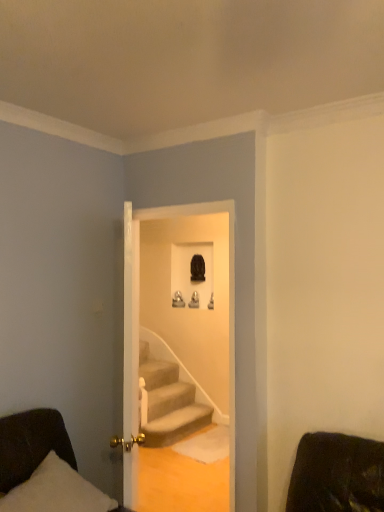
I want to click on dark brown leather couch at lower left, so click(x=31, y=445).

What do you see at coordinates (31, 445) in the screenshot?
I see `dark brown leather couch at lower left` at bounding box center [31, 445].

In order to face dark brown leather couch at lower left, should I rotate leftwards or rightwards?

A 16.741 degree turn to the left will do.

You are a GUI agent. You are given a task and a screenshot of the screen. Output one action in this format:
    pyautogui.click(x=<x>, y=<y>)
    Task: Click on the dark brown leather couch at lower left
    Image resolution: width=384 pixels, height=512 pixels.
    Given the screenshot: What is the action you would take?
    pyautogui.click(x=31, y=445)